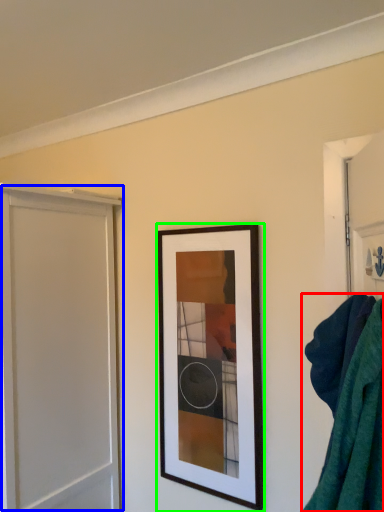
Question: Which object is the farthest from bath towel (highlighted by a red box)? Choose among these: screen door (highlighted by a blue box) or picture frame (highlighted by a green box).

Choices:
 (A) screen door
 (B) picture frame

Answer: (A)